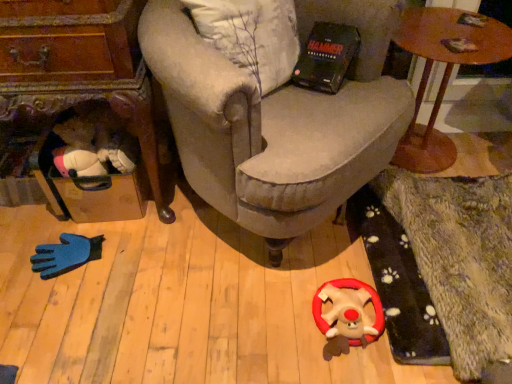
Question: Is wooden round table at upper right, the first table in the right-to-left sequence, smaller than fluffy plush toy at center?

Choices:
 (A) no
 (B) yes

Answer: (A)

Question: Is wooden round table at upper right, which is counted as the 2th table, starting from the left, not close to fluffy plush toy at center?

Choices:
 (A) no
 (B) yes

Answer: (A)

Question: Considering the relative sizes of wooden round table at upper right, which is counted as the 2th table, starting from the left, and fluffy plush toy at center in the image provided, is wooden round table at upper right, which is counted as the 2th table, starting from the left, wider than fluffy plush toy at center?

Choices:
 (A) no
 (B) yes

Answer: (B)

Question: Is fluffy plush toy at center surrounded by wooden round table at upper right, the first table in the right-to-left sequence?

Choices:
 (A) yes
 (B) no

Answer: (B)

Question: From a real-world perspective, is wooden round table at upper right, which is counted as the 2th table, starting from the left, on top of fluffy plush toy at center?

Choices:
 (A) yes
 (B) no

Answer: (A)

Question: From a real-world perspective, is fluffy plush toy at center positioned above or below velvet beige armchair at center?

Choices:
 (A) below
 (B) above

Answer: (A)

Question: Do you think fluffy plush toy at center is within velvet beige armchair at center, or outside of it?

Choices:
 (A) inside
 (B) outside

Answer: (B)

Question: Considering the positions of fluffy plush toy at center and velvet beige armchair at center in the image, is fluffy plush toy at center bigger or smaller than velvet beige armchair at center?

Choices:
 (A) big
 (B) small

Answer: (B)

Question: Is fluffy plush toy at center wider or thinner than velvet beige armchair at center?

Choices:
 (A) wide
 (B) thin

Answer: (B)

Question: Is point click(x=94, y=67) positioned closer to the camera than point click(x=419, y=34)?

Choices:
 (A) closer
 (B) farther

Answer: (A)

Question: In the image, is wooden suitcase at left, marked as the 2th table in a right-to-left arrangement, on the left side or the right side of wooden round table at upper right, the first table in the right-to-left sequence?

Choices:
 (A) right
 (B) left

Answer: (B)

Question: Considering the positions of wooden suitcase at left, arranged as the 1th table when viewed from the left, and wooden round table at upper right, which is counted as the 2th table, starting from the left, in the image, is wooden suitcase at left, arranged as the 1th table when viewed from the left, bigger or smaller than wooden round table at upper right, which is counted as the 2th table, starting from the left,?

Choices:
 (A) small
 (B) big

Answer: (A)

Question: From a real-world perspective, is wooden suitcase at left, arranged as the 1th table when viewed from the left, physically located above or below wooden round table at upper right, which is counted as the 2th table, starting from the left?

Choices:
 (A) below
 (B) above

Answer: (A)

Question: Considering the positions of wooden suitcase at left, arranged as the 1th table when viewed from the left, and velvet beige armchair at center in the image, is wooden suitcase at left, arranged as the 1th table when viewed from the left, taller or shorter than velvet beige armchair at center?

Choices:
 (A) tall
 (B) short

Answer: (B)

Question: Looking at the image, does wooden suitcase at left, marked as the 2th table in a right-to-left arrangement, seem bigger or smaller compared to velvet beige armchair at center?

Choices:
 (A) small
 (B) big

Answer: (A)